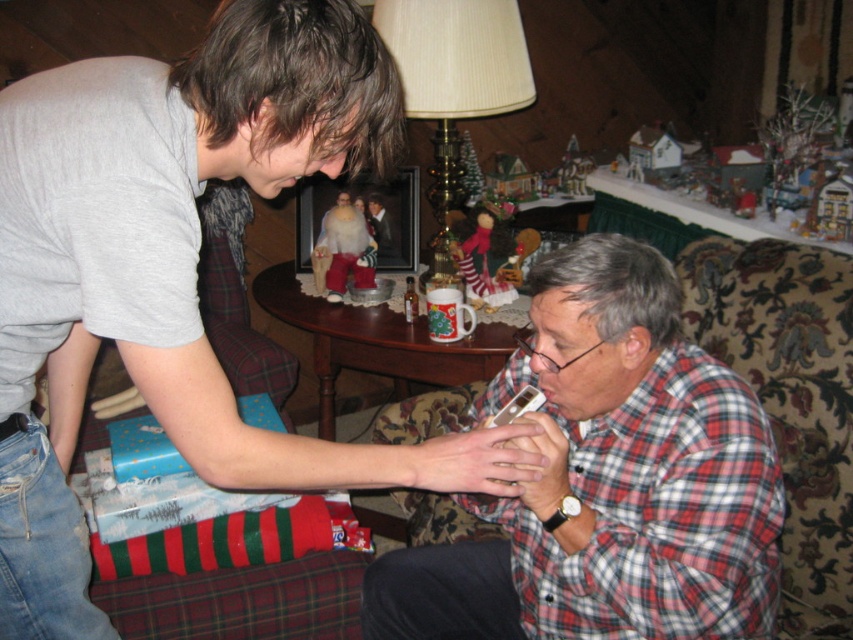
You are a tailor trying to fit two shirts into a display case. The plaid flannel shirt at lower right and the plaid fabric shirt at lower right. The display case can only accommodate items up to the width of the wider shirt. Which shirt determines the minimum required width for the display case?

The plaid flannel shirt at lower right determines the minimum required width for the display case because its width surpasses that of the plaid fabric shirt at lower right.

You are standing in the living room and want to place a 10 inch long decorative pillow between the plaid flannel shirt at lower right and the plaid fabric shirt at lower right. Will there be enough space?

The plaid flannel shirt at lower right is 12.81 inches away from the plaid fabric shirt at lower right. Since the pillow is 10 inches long, there is enough space to place it between them.